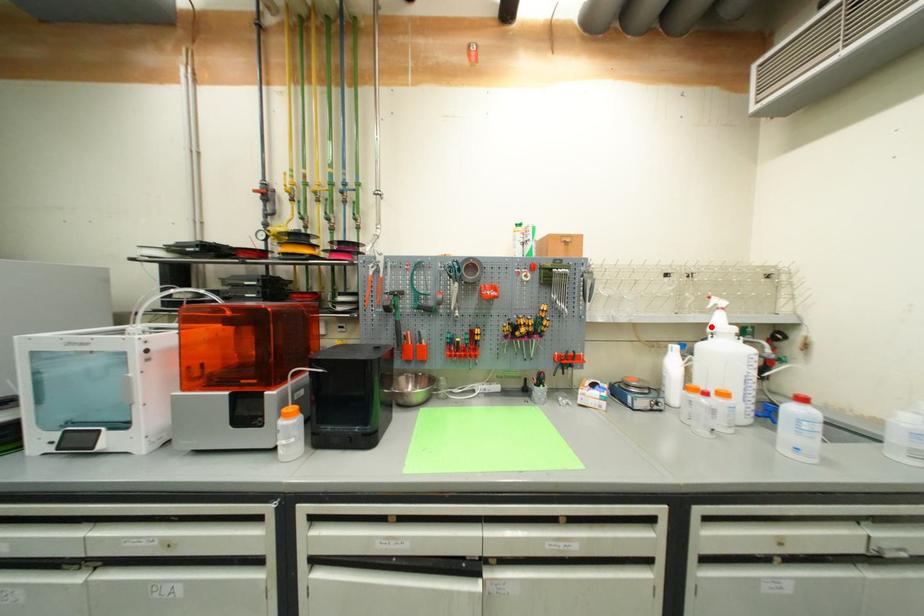
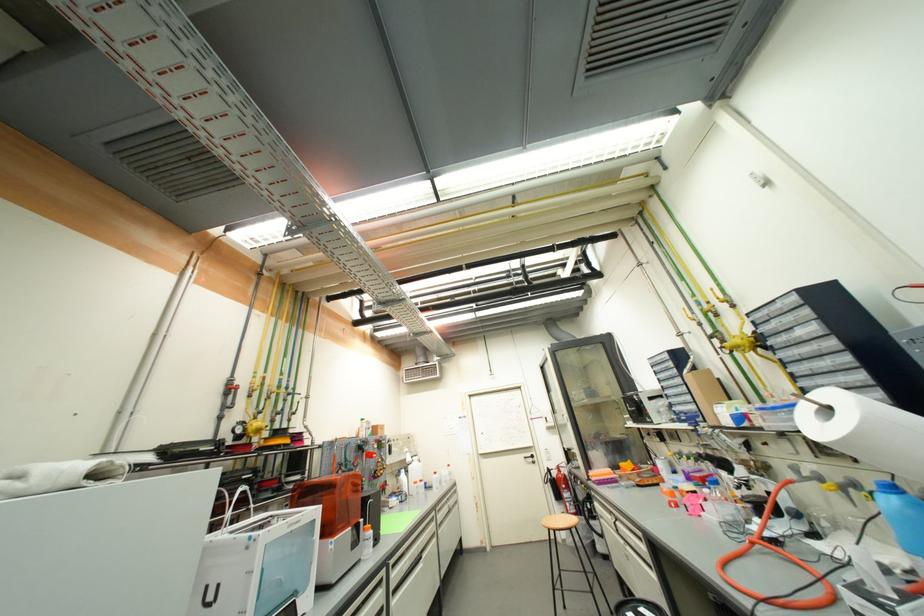
The point at the highlighted location is marked in the first image. Where is the corresponding point in the second image?

(410, 461)